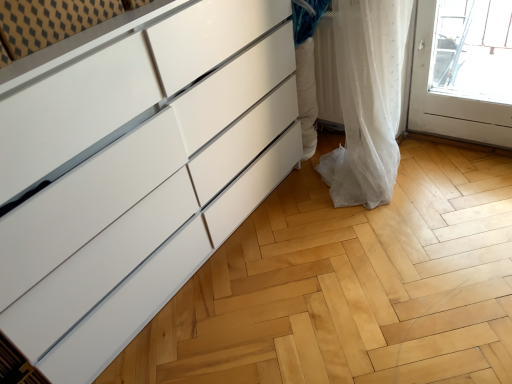
Question: Can you confirm if white sheer curtain at lower right is thinner than white glossy chest of drawers at left?

Choices:
 (A) yes
 (B) no

Answer: (B)

Question: Is white sheer curtain at lower right far away from white glossy chest of drawers at left?

Choices:
 (A) no
 (B) yes

Answer: (A)

Question: From the image's perspective, does white sheer curtain at lower right appear higher than white glossy chest of drawers at left?

Choices:
 (A) yes
 (B) no

Answer: (A)

Question: From a real-world perspective, is white sheer curtain at lower right positioned under white glossy chest of drawers at left based on gravity?

Choices:
 (A) no
 (B) yes

Answer: (B)

Question: Does white sheer curtain at lower right turn towards white glossy chest of drawers at left?

Choices:
 (A) yes
 (B) no

Answer: (B)

Question: Is white sheer curtain at lower right at the right side of white glossy chest of drawers at left?

Choices:
 (A) no
 (B) yes

Answer: (B)

Question: Can you confirm if white glossy chest of drawers at left is positioned to the right of white sheer curtain at lower right?

Choices:
 (A) yes
 (B) no

Answer: (B)

Question: From a real-world perspective, is white glossy chest of drawers at left located higher than white sheer curtain at lower right?

Choices:
 (A) yes
 (B) no

Answer: (A)

Question: From the image's perspective, would you say white glossy chest of drawers at left is shown under white sheer curtain at lower right?

Choices:
 (A) yes
 (B) no

Answer: (A)

Question: Does white glossy chest of drawers at left have a larger size compared to white sheer curtain at lower right?

Choices:
 (A) no
 (B) yes

Answer: (B)

Question: Is white glossy chest of drawers at left facing away from white sheer curtain at lower right?

Choices:
 (A) no
 (B) yes

Answer: (A)

Question: From the image's perspective, would you say white glossy chest of drawers at left is positioned over white sheer curtain at lower right?

Choices:
 (A) yes
 (B) no

Answer: (B)

Question: From the image's perspective, relative to white sheer curtain at lower right, is white glossy chest of drawers at left above or below?

Choices:
 (A) above
 (B) below

Answer: (B)